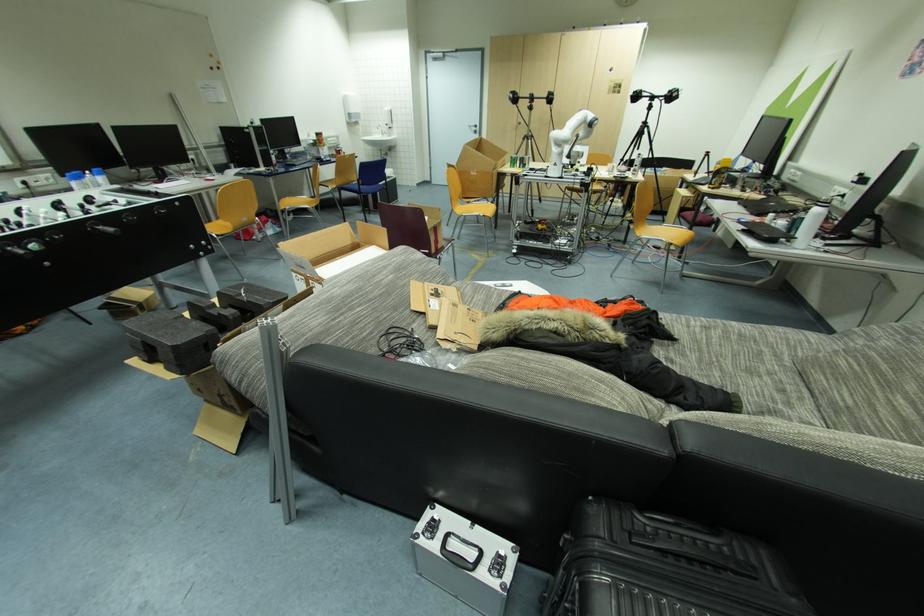
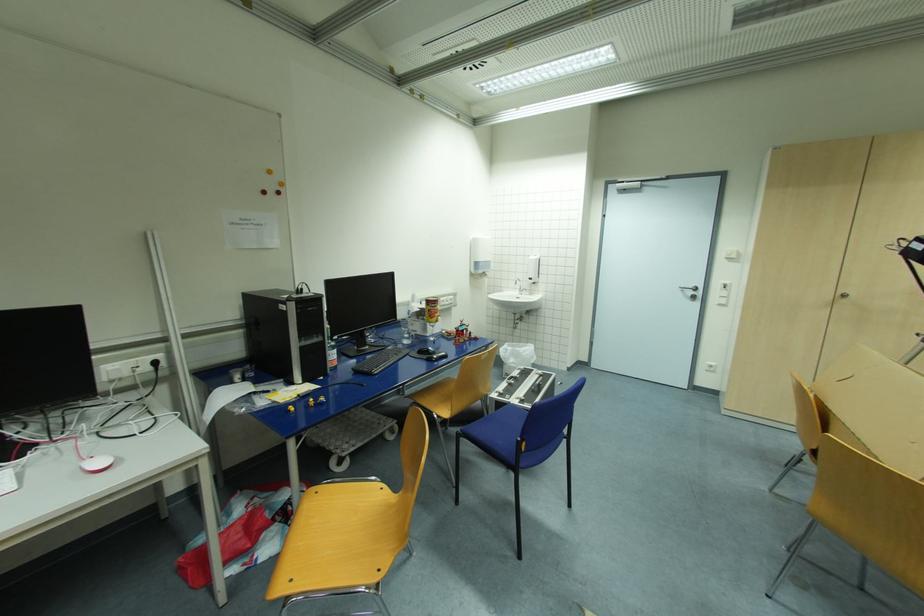
The point at (322, 136) is marked in the first image. Where is the corresponding point in the second image?

(433, 302)